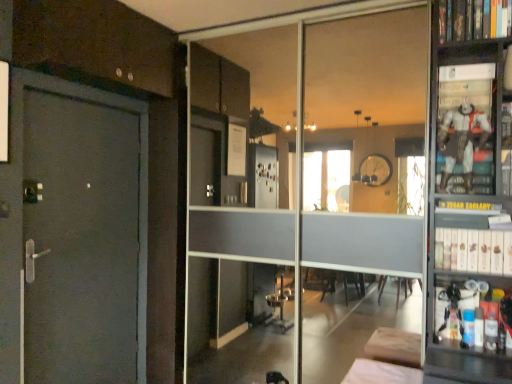
Question: Does hardcover book at upper right, the 2th book ordered from the bottom, have a larger size compared to white fabric bed at lower center?

Choices:
 (A) no
 (B) yes

Answer: (A)

Question: Considering the relative sizes of hardcover book at upper right, the 1th book positioned from the top, and white fabric bed at lower center in the image provided, is hardcover book at upper right, the 1th book positioned from the top, smaller than white fabric bed at lower center?

Choices:
 (A) yes
 (B) no

Answer: (A)

Question: Is hardcover book at upper right, the 2th book ordered from the bottom, not inside white fabric bed at lower center?

Choices:
 (A) no
 (B) yes

Answer: (B)

Question: Does hardcover book at upper right, the 1th book positioned from the top, appear on the right side of white fabric bed at lower center?

Choices:
 (A) no
 (B) yes

Answer: (B)

Question: Considering the relative sizes of hardcover book at upper right, the 1th book positioned from the top, and white fabric bed at lower center in the image provided, is hardcover book at upper right, the 1th book positioned from the top, taller than white fabric bed at lower center?

Choices:
 (A) no
 (B) yes

Answer: (B)

Question: Considering the positions of metallic figure at right and white matte bookshelf at right, which is counted as the 1th book, starting from the bottom, in the image, is metallic figure at right taller or shorter than white matte bookshelf at right, which is counted as the 1th book, starting from the bottom,?

Choices:
 (A) short
 (B) tall

Answer: (B)

Question: From the image's perspective, relative to white matte bookshelf at right, which is counted as the 2th book, starting from the top, is metallic figure at right above or below?

Choices:
 (A) above
 (B) below

Answer: (A)

Question: In the image, is metallic figure at right on the left side or the right side of white matte bookshelf at right, which is counted as the 2th book, starting from the top?

Choices:
 (A) right
 (B) left

Answer: (B)

Question: In the image, is metallic figure at right positioned in front of or behind white matte bookshelf at right, which is counted as the 2th book, starting from the top?

Choices:
 (A) behind
 (B) front

Answer: (A)

Question: From a real-world perspective, is metallic figure at right positioned above or below hardcover book at upper right, the 2th book ordered from the bottom?

Choices:
 (A) above
 (B) below

Answer: (B)

Question: From the image's perspective, is metallic figure at right positioned above or below hardcover book at upper right, the 1th book positioned from the top?

Choices:
 (A) above
 (B) below

Answer: (B)

Question: Is metallic figure at right wider or thinner than hardcover book at upper right, the 2th book ordered from the bottom?

Choices:
 (A) wide
 (B) thin

Answer: (B)

Question: From their relative heights in the image, would you say metallic figure at right is taller or shorter than hardcover book at upper right, the 1th book positioned from the top?

Choices:
 (A) short
 (B) tall

Answer: (B)

Question: Looking at the image, does transparent glass door at center seem bigger or smaller compared to white matte bookshelf at right, which is counted as the 2th book, starting from the top?

Choices:
 (A) big
 (B) small

Answer: (A)

Question: From a real-world perspective, is transparent glass door at center above or below white matte bookshelf at right, which is counted as the 1th book, starting from the bottom?

Choices:
 (A) above
 (B) below

Answer: (A)